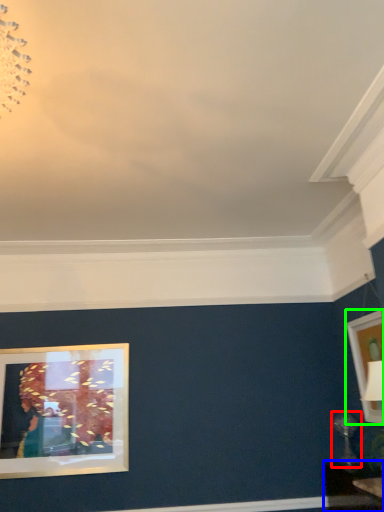
Question: Which object is positioned closest to table lamp (highlighted by a red box)? Select from table (highlighted by a blue box) and picture frame (highlighted by a green box).

Choices:
 (A) table
 (B) picture frame

Answer: (A)